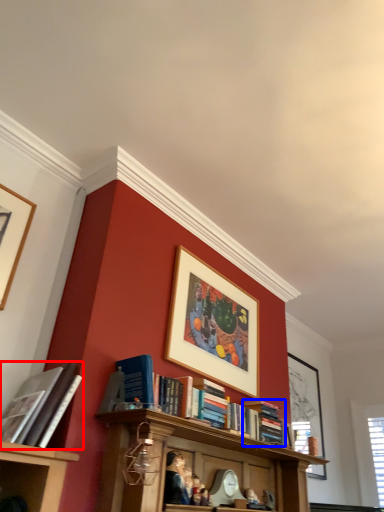
Question: Among these objects, which one is nearest to the camera, book (highlighted by a red box) or book (highlighted by a blue box)?

Choices:
 (A) book
 (B) book

Answer: (A)